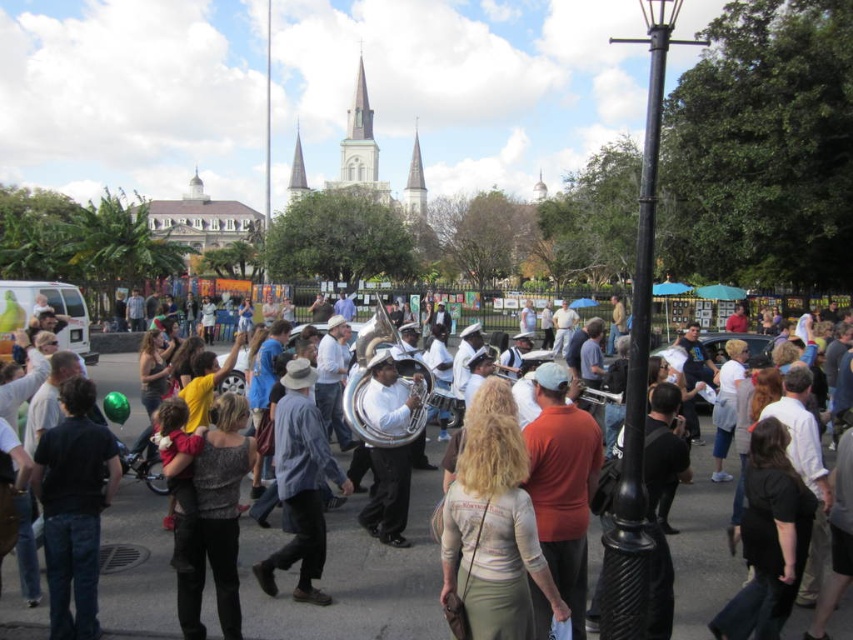
Between white shirt at center and blue plaid shirt at center, which one is positioned higher?

Positioned higher is blue plaid shirt at center.

In order to click on white shirt at center in this screenshot , I will do click(352, 580).

Identify the location of white shirt at center. Image resolution: width=853 pixels, height=640 pixels. (352, 580).